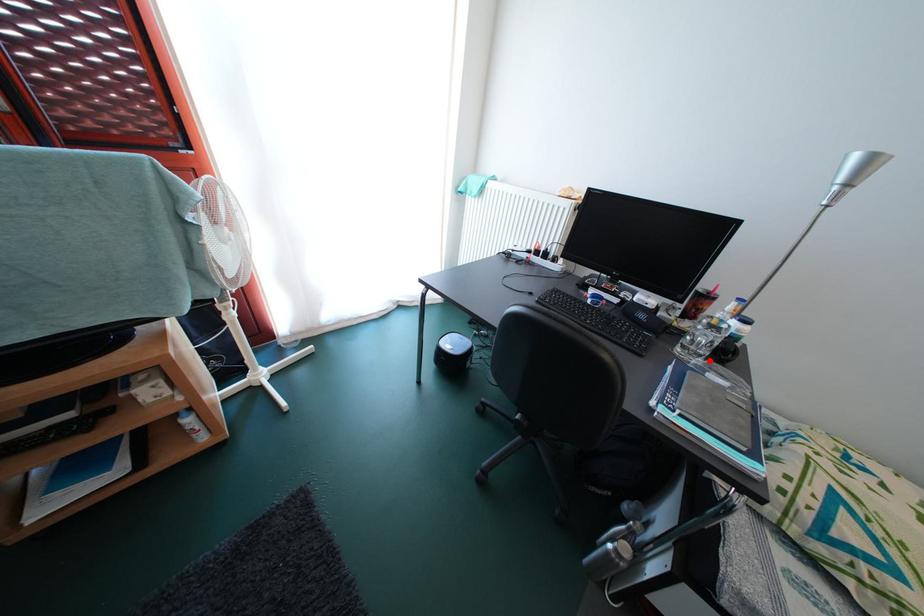
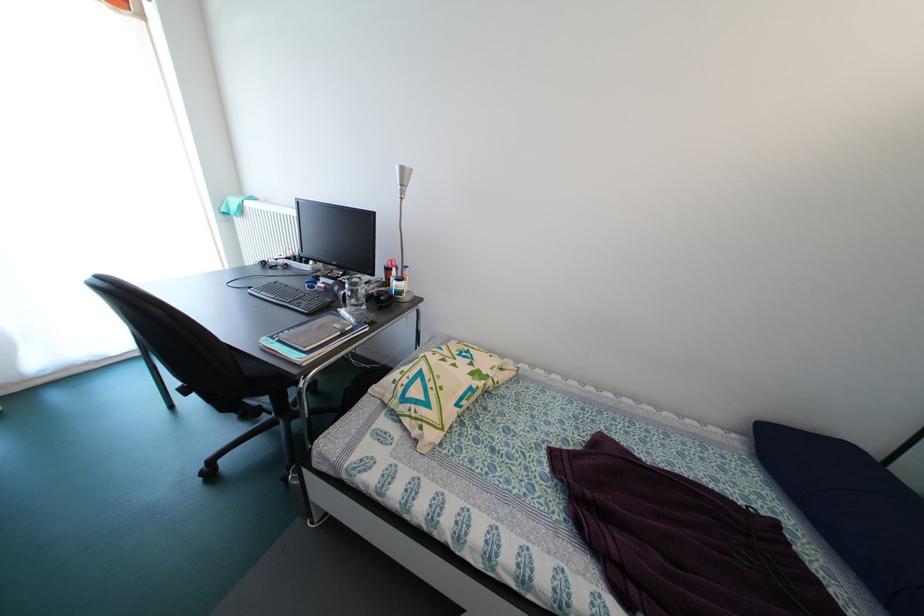
The point at the highlighted location is marked in the first image. Where is the corresponding point in the second image?

(362, 310)